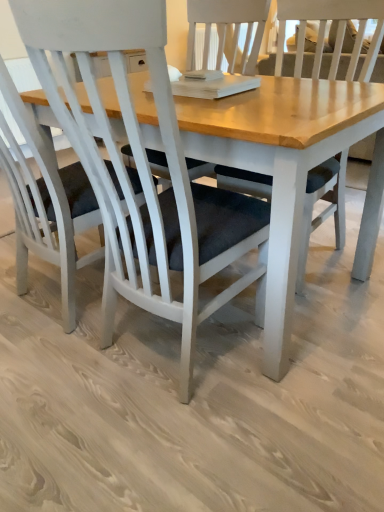
This screenshot has height=512, width=384. I want to click on vacant space underneath white matte chair at center, the 2th chair from the left (from a real-world perspective), so click(170, 355).